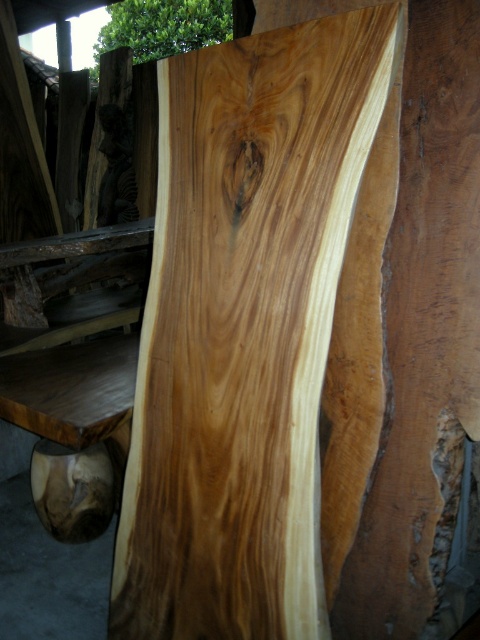
Question: Which point is closer to the camera taking this photo?

Choices:
 (A) (279, 387)
 (B) (171, 40)

Answer: (A)

Question: Does natural wood plank at center have a greater width compared to green leafy tree at upper center?

Choices:
 (A) yes
 (B) no

Answer: (B)

Question: Is natural wood plank at center bigger than green leafy tree at upper center?

Choices:
 (A) yes
 (B) no

Answer: (A)

Question: Can you confirm if natural wood plank at center is positioned below green leafy tree at upper center?

Choices:
 (A) yes
 (B) no

Answer: (A)

Question: Among these points, which one is nearest to the camera?

Choices:
 (A) (218, 13)
 (B) (310, 109)

Answer: (B)